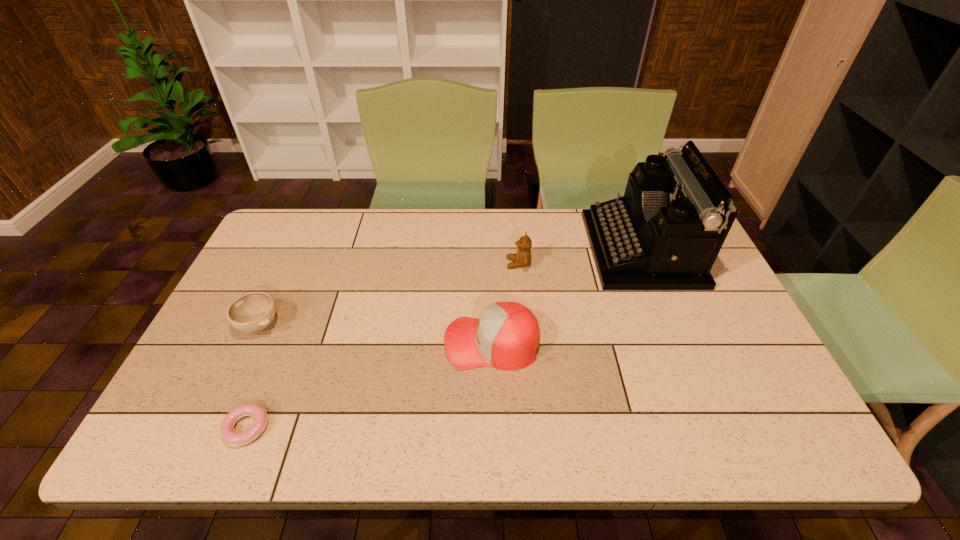
This screenshot has width=960, height=540. What are the coordinates of `vacant space that satisfies the following two spatial constraints: 1. on the front-facing side of the teddy bear; 2. on the front side of the second shortest object` in the screenshot? It's located at [524, 325].

The image size is (960, 540). I want to click on free space that satisfies the following two spatial constraints: 1. on the typing side of the typewriter; 2. on the front side of the second shortest object, so click(672, 325).